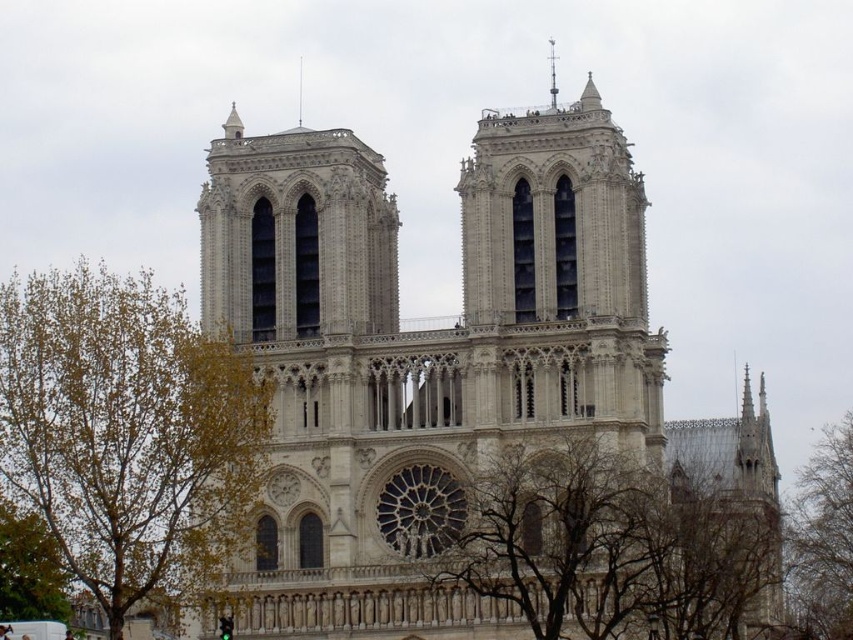
You are standing in front of Notre Dame Cathedral and notice a green leafy tree at left and bare branches at lower center. Which object is closer to you?

The green leafy tree at left is closer to you because the bare branches at lower center is behind it.

You are standing in front of the Notre Dame Cathedral and notice a green leafy tree at left and a smooth stone spire at upper center. Which object is positioned higher in the image?

The smooth stone spire at upper center is positioned higher than the green leafy tree at left.